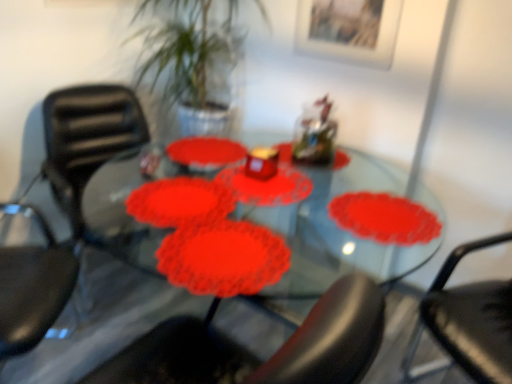
Question: Is point pos(94,238) positioned closer to the camera than point pos(480,241)?

Choices:
 (A) farther
 (B) closer

Answer: (A)

Question: Considering the positions of matte black chair at left, which ranks as the first chair in left-to-right order, and black plastic chair at right, acting as the 1th chair starting from the right, in the image, is matte black chair at left, which ranks as the first chair in left-to-right order, taller or shorter than black plastic chair at right, acting as the 1th chair starting from the right,?

Choices:
 (A) tall
 (B) short

Answer: (B)

Question: Based on their sizes in the image, would you say matte black chair at left, which ranks as the first chair in left-to-right order, is bigger or smaller than black plastic chair at right, the second chair when ordered from left to right?

Choices:
 (A) big
 (B) small

Answer: (A)

Question: Relative to matte black chair at left, which ranks as the first chair in left-to-right order, is black plastic chair at right, acting as the 1th chair starting from the right, in front or behind?

Choices:
 (A) behind
 (B) front

Answer: (B)

Question: Is black plastic chair at right, the second chair when ordered from left to right, wider or thinner than matte black chair at left, the second chair in the right-to-left sequence?

Choices:
 (A) thin
 (B) wide

Answer: (B)

Question: Does point (500, 314) appear closer or farther from the camera than point (81, 215)?

Choices:
 (A) closer
 (B) farther

Answer: (A)

Question: From their relative heights in the image, would you say black plastic chair at right, the second chair when ordered from left to right, is taller or shorter than matte black chair at left, which ranks as the first chair in left-to-right order?

Choices:
 (A) short
 (B) tall

Answer: (B)